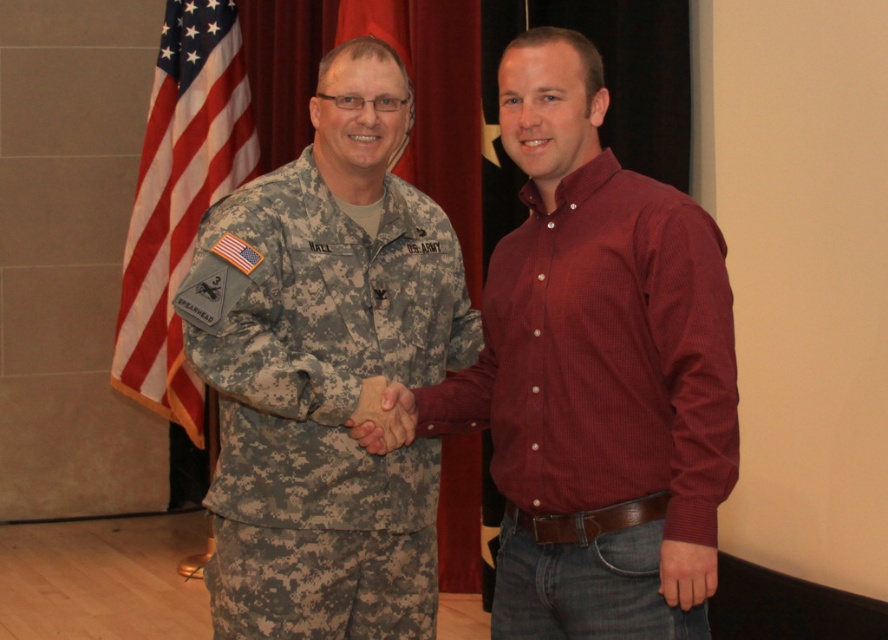
You are a photographer trying to capture a closeup of the two points in the image. Which point, point (400, 227) or point (414, 154), is closer to your camera lens?

Point (400, 227) is closer to the camera lens than point (414, 154).

You are a photographer standing at the point marked by the coordinate point at (466, 422). You want to take a photo of the two people shaking hands. Since you need to maintain a distance of at least 2 meters from them to avoid being in the frame, can you safely stand at your current position?

The two people are 2.45 meters apart. Since you are standing at the point marked by the coordinate point at (466, 422), you need to ensure that your distance from both individuals is at least 2 meters. However, without knowing the exact positions of the two people relative to your location, it is impossible to determine if your current position meets the requirement. Please check the distance from each person individually.

Please provide the 2D coordinates of the camouflage fabric uniform at center as observed in the image.

→ The camouflage fabric uniform at center is located at the 2D coordinates of point (321, 403).